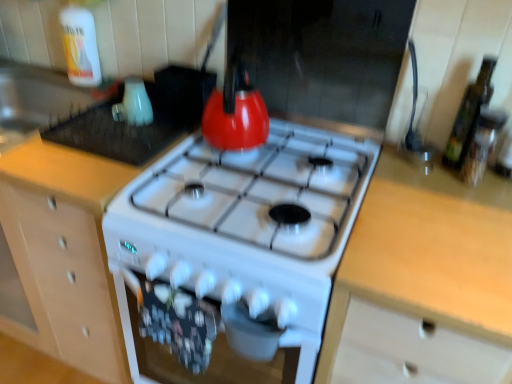
In order to face white glossy kettle at upper left, placed as the 2th appliance when sorted from right to left, should I rotate leftwards or rightwards?

You should look left and rotate roughly 16.099 degrees.

Locate an element on the screen. wooden cabinet at center is located at coordinates (64, 252).

Considering the relative positions of wooden cabinet at center and green glass bottle at right, the 2th bottle in the back-to-front sequence, in the image provided, is wooden cabinet at center to the left or to the right of green glass bottle at right, the 2th bottle in the back-to-front sequence,?

In the image, wooden cabinet at center appears on the left side of green glass bottle at right, the 2th bottle in the back-to-front sequence.

Which is farther, (55, 228) or (496, 62)?

The point (55, 228) is more distant.

Considering the relative sizes of white glossy kettle at upper left, placed as the 2th appliance when sorted from right to left, and light wood countertop at right in the image provided, is white glossy kettle at upper left, placed as the 2th appliance when sorted from right to left, taller than light wood countertop at right?

Incorrect, the height of white glossy kettle at upper left, placed as the 2th appliance when sorted from right to left, is not larger of that of light wood countertop at right.

Is white glossy kettle at upper left, the 1th appliance when ordered from left to right, situated inside light wood countertop at right or outside?

white glossy kettle at upper left, the 1th appliance when ordered from left to right, lies outside light wood countertop at right.

Considering their positions, is white glossy kettle at upper left, the 1th appliance when ordered from left to right, located in front of or behind light wood countertop at right?

Visually, white glossy kettle at upper left, the 1th appliance when ordered from left to right, is located behind light wood countertop at right.

From a real-world perspective, who is located lower, green glass bottle at right, which is counted as the first bottle, starting from the front, or wooden cabinet at center?

From a 3D spatial view, wooden cabinet at center is below.

From the image's perspective, does green glass bottle at right, the 2th bottle from the top, appear higher than wooden cabinet at center?

Yes, from the image's perspective, green glass bottle at right, the 2th bottle from the top, is above wooden cabinet at center.

Who is bigger, green glass bottle at right, which is counted as the first bottle, starting from the front, or wooden cabinet at center?

With larger size is wooden cabinet at center.

Identify the location of bottle on the right of light wood countertop at right. The height and width of the screenshot is (384, 512). (469, 115).

From a real-world perspective, is light wood countertop at right physically above green glass bottle at right, the 1th bottle viewed from the right?

No.

Between light wood countertop at right and green glass bottle at right, the second bottle viewed from the left, which one is positioned in front?

light wood countertop at right is closer to the camera.

Consider the image. Are light wood countertop at right and green glass bottle at right, the 2th bottle in the back-to-front sequence, far apart?

Actually, light wood countertop at right and green glass bottle at right, the 2th bottle in the back-to-front sequence, are a little close together.

Does green glass bottle at right, the 1th bottle viewed from the right, turn towards white glossy kettle at upper left, the 1th appliance when ordered from left to right?

No, green glass bottle at right, the 1th bottle viewed from the right, is not facing towards white glossy kettle at upper left, the 1th appliance when ordered from left to right.

Is point (475, 122) closer or farther from the camera than point (122, 106)?

Point (475, 122).

Is white glossy kettle at upper left, the 1th appliance when ordered from left to right, not close to wooden cabinet at center?

Actually, white glossy kettle at upper left, the 1th appliance when ordered from left to right, and wooden cabinet at center are a little close together.

Is wooden cabinet at center located within white glossy kettle at upper left, the 1th appliance when ordered from left to right?

Actually, wooden cabinet at center is outside white glossy kettle at upper left, the 1th appliance when ordered from left to right.

Considering the positions of objects white glossy kettle at upper left, the 1th appliance when ordered from left to right, and wooden cabinet at center in the image provided, who is more to the left, white glossy kettle at upper left, the 1th appliance when ordered from left to right, or wooden cabinet at center?

Positioned to the left is wooden cabinet at center.

Can you see wooden cabinet at center touching light wood countertop at right?

They are not placed beside each other.

Is point (51, 333) closer or farther from the camera than point (454, 350)?

Clearly, point (51, 333) is more distant from the camera than point (454, 350).

Is light wood countertop at right at the back of wooden cabinet at center?

No, light wood countertop at right is not at the back of wooden cabinet at center.

From the image's perspective, starting from the wooden cabinet at center, which bottle is the 1st one above? Please provide its 2D coordinates.

[(469, 115)]

Where is `appliance that is the 2nd one when counting leftward from the light wood countertop at right`? The image size is (512, 384). appliance that is the 2nd one when counting leftward from the light wood countertop at right is located at coordinates (134, 104).

Looking at the image, which one is located further to green glass bottle at right, which is counted as the 1th bottle, starting from the bottom, matte white kettle at upper left, marked as the 2th appliance in a left-to-right arrangement, or white glossy kettle at upper left, placed as the 2th appliance when sorted from right to left?

Among the two, white glossy kettle at upper left, placed as the 2th appliance when sorted from right to left, is located further to green glass bottle at right, which is counted as the 1th bottle, starting from the bottom.

Estimate the real-world distances between objects in this image. Which object is closer to light wood countertop at right, white glossy kettle at upper left, placed as the 2th appliance when sorted from right to left, or wooden cabinet at center?

Among the two, wooden cabinet at center is located nearer to light wood countertop at right.

From the image, which object appears to be nearer to wooden cabinet at center, translucent plastic bottle at upper left, arranged as the 2th bottle when viewed from the right, or white glossy kettle at upper left, the 1th appliance when ordered from left to right?

white glossy kettle at upper left, the 1th appliance when ordered from left to right, is closer to wooden cabinet at center.

Estimate the real-world distances between objects in this image. Which object is further from light wood countertop at right, wooden cabinet at center or matte white kettle at upper left, the first appliance from the right?

wooden cabinet at center lies further to light wood countertop at right than the other object.

From the image, which object appears to be farther from wooden cabinet at center, light wood countertop at right or translucent plastic bottle at upper left, which appears as the 1th bottle when viewed from the top?

The object further to wooden cabinet at center is light wood countertop at right.

Considering their positions, is white glossy kettle at upper left, placed as the 2th appliance when sorted from right to left, positioned further to translucent plastic bottle at upper left, which appears as the 1th bottle when viewed from the top, than light wood countertop at right?

Based on the image, light wood countertop at right appears to be further to translucent plastic bottle at upper left, which appears as the 1th bottle when viewed from the top.

From the image, which object appears to be nearer to matte white kettle at upper left, the first appliance from the right, green glass bottle at right, the second bottle viewed from the left, or white glossy kettle at upper left, placed as the 2th appliance when sorted from right to left?

white glossy kettle at upper left, placed as the 2th appliance when sorted from right to left, lies closer to matte white kettle at upper left, the first appliance from the right, than the other object.

Considering their positions, is matte white kettle at upper left, marked as the 2th appliance in a left-to-right arrangement, positioned closer to translucent plastic bottle at upper left, positioned as the 1th bottle in back-to-front order, than green glass bottle at right, which is counted as the 1th bottle, starting from the bottom?

matte white kettle at upper left, marked as the 2th appliance in a left-to-right arrangement, is closer to translucent plastic bottle at upper left, positioned as the 1th bottle in back-to-front order.

Find the location of a particular element. Image resolution: width=512 pixels, height=384 pixels. bottle located between wooden cabinet at center and light wood countertop at right in the left-right direction is located at coordinates [x=80, y=46].

You are a GUI agent. You are given a task and a screenshot of the screen. Output one action in this format:
    pyautogui.click(x=<x>, y=<y>)
    Task: Click on the counter between white glossy kettle at upper left, the 1th appliance when ordered from left to right, and green glass bottle at right, the 1th bottle viewed from the right, in the horizontal direction
    
    Given the screenshot: What is the action you would take?
    pyautogui.click(x=428, y=274)

Where is `counter situated between wooden cabinet at center and green glass bottle at right, which is counted as the 1th bottle, starting from the bottom, from left to right`? This screenshot has width=512, height=384. counter situated between wooden cabinet at center and green glass bottle at right, which is counted as the 1th bottle, starting from the bottom, from left to right is located at coordinates (428, 274).

Where is `bottle between wooden cabinet at center and green glass bottle at right, the second bottle viewed from the left, from left to right`? bottle between wooden cabinet at center and green glass bottle at right, the second bottle viewed from the left, from left to right is located at coordinates (80, 46).